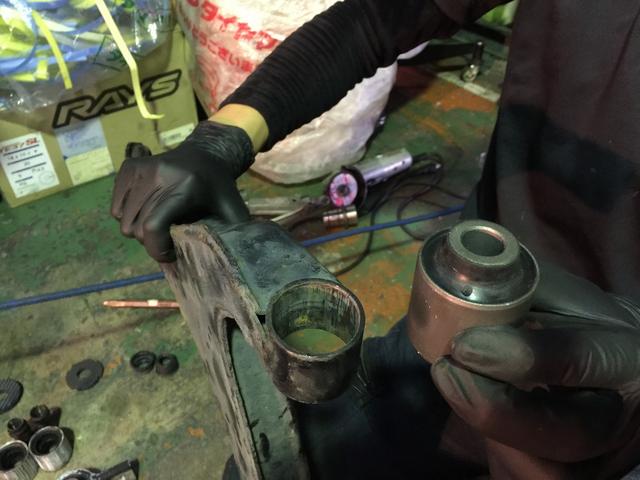
You are a GUI agent. You are given a task and a screenshot of the screen. Output one action in this format:
    pyautogui.click(x=<x>, y=<y>)
    Task: Click on the bracket
    Image resolution: width=640 pixels, height=480 pixels.
    Given the screenshot: What is the action you would take?
    pyautogui.click(x=223, y=305)